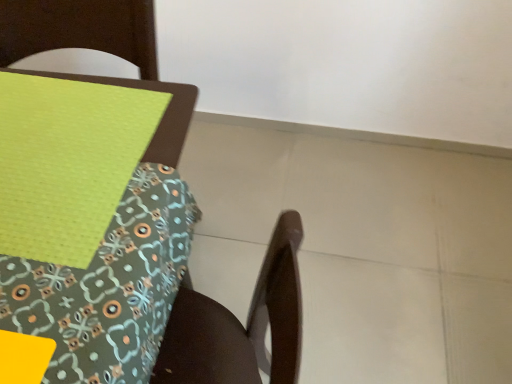
The height and width of the screenshot is (384, 512). What do you see at coordinates (67, 162) in the screenshot?
I see `green fabric placemat at upper left` at bounding box center [67, 162].

Image resolution: width=512 pixels, height=384 pixels. Identify the location of green fabric placemat at upper left. (67, 162).

What is the approximate width of wooden chair at lower right?

17.89 inches.

This screenshot has width=512, height=384. What are the coordinates of `wooden chair at lower right` in the screenshot? It's located at (238, 325).

What do you see at coordinates (238, 325) in the screenshot?
I see `wooden chair at lower right` at bounding box center [238, 325].

Find the location of `green fabric placemat at upper left`. green fabric placemat at upper left is located at coordinates click(x=67, y=162).

Is green fabric placemat at upper left to the left or to the right of wooden chair at lower right in the image?

green fabric placemat at upper left is to the left of wooden chair at lower right.

Is green fabric placemat at upper left in front of or behind wooden chair at lower right in the image?

In the image, green fabric placemat at upper left appears behind wooden chair at lower right.

Which is less distant, [46,129] or [18,15]?

Point [46,129]

From the image's perspective, is green fabric placemat at upper left beneath wooden chair at lower right?

Incorrect, from the image's perspective, green fabric placemat at upper left is higher than wooden chair at lower right.

From a real-world perspective, which is physically below, green fabric placemat at upper left or wooden chair at lower right?

In real-world perspective, wooden chair at lower right is lower.

Which of these two, green fabric placemat at upper left or wooden chair at lower right, is wider?

wooden chair at lower right.

From the picture: Considering the sizes of green fabric placemat at upper left and wooden chair at lower right in the image, is green fabric placemat at upper left taller or shorter than wooden chair at lower right?

Considering their sizes, green fabric placemat at upper left has less height than wooden chair at lower right.

Looking at the image, does green fabric placemat at upper left seem bigger or smaller compared to wooden chair at lower right?

Clearly, green fabric placemat at upper left is smaller in size than wooden chair at lower right.

Would you say green fabric placemat at upper left contains wooden chair at lower right?

Actually, wooden chair at lower right is outside green fabric placemat at upper left.

Are green fabric placemat at upper left and wooden chair at lower right far apart?

That's not correct — green fabric placemat at upper left is a little close to wooden chair at lower right.

Is green fabric placemat at upper left facing away from wooden chair at lower right?

No, wooden chair at lower right is not at the back of green fabric placemat at upper left.

Can you tell me how much green fabric placemat at upper left and wooden chair at lower right differ in facing direction?

94.6 degrees separate the facing orientations of green fabric placemat at upper left and wooden chair at lower right.

I want to click on sheet on the left of wooden chair at lower right, so click(67, 162).

Between wooden chair at lower right and green fabric placemat at upper left, which one appears on the left side from the viewer's perspective?

green fabric placemat at upper left is more to the left.

Based on the photo, does wooden chair at lower right come in front of green fabric placemat at upper left?

Yes.

Considering the positions of points (188, 117) and (13, 186), is point (188, 117) farther from camera compared to point (13, 186)?

Yes, it is.

From the image's perspective, is wooden chair at lower right over green fabric placemat at upper left?

Actually, wooden chair at lower right appears below green fabric placemat at upper left in the image.

From a real-world perspective, is wooden chair at lower right positioned over green fabric placemat at upper left based on gravity?

Incorrect, from a real-world perspective, wooden chair at lower right is lower than green fabric placemat at upper left.

Considering the relative sizes of wooden chair at lower right and green fabric placemat at upper left in the image provided, is wooden chair at lower right thinner than green fabric placemat at upper left?

Incorrect, the width of wooden chair at lower right is not less than that of green fabric placemat at upper left.

Who is taller, wooden chair at lower right or green fabric placemat at upper left?

wooden chair at lower right.

Considering the sizes of objects wooden chair at lower right and green fabric placemat at upper left in the image provided, who is bigger, wooden chair at lower right or green fabric placemat at upper left?

wooden chair at lower right is bigger.

Is wooden chair at lower right inside the boundaries of green fabric placemat at upper left, or outside?

wooden chair at lower right is located beyond the bounds of green fabric placemat at upper left.

Is there a large distance between wooden chair at lower right and green fabric placemat at upper left?

No.

Is wooden chair at lower right oriented towards green fabric placemat at upper left?

Yes, wooden chair at lower right is turned towards green fabric placemat at upper left.

How many degrees apart are the facing directions of wooden chair at lower right and green fabric placemat at upper left?

The angle between the facing direction of wooden chair at lower right and the facing direction of green fabric placemat at upper left is 94.6 degrees.

You are a GUI agent. You are given a task and a screenshot of the screen. Output one action in this format:
    pyautogui.click(x=<x>, y=<y>)
    Task: Click on the chair to the right of green fabric placemat at upper left
    This screenshot has height=384, width=512.
    Given the screenshot: What is the action you would take?
    pyautogui.click(x=238, y=325)

Find the location of `chair below the green fabric placemat at upper left (from a real-world perspective)`. chair below the green fabric placemat at upper left (from a real-world perspective) is located at coordinates (238, 325).

Identify the location of sheet on the left of wooden chair at lower right. (67, 162).